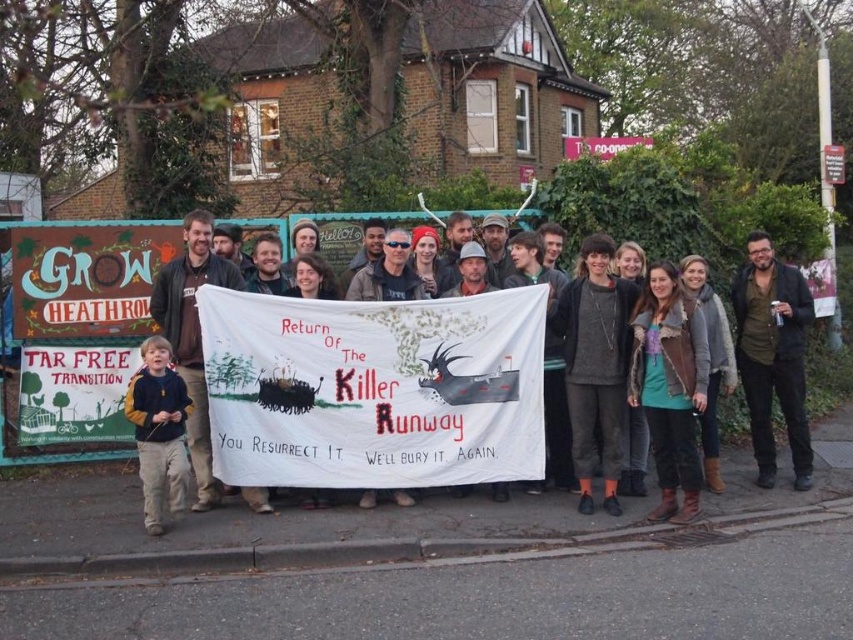
Question: Which object appears farthest from the camera in this image?

Choices:
 (A) black leather jacket at right
 (B) wooden signboard at left
 (C) brown suede boots at lower center
 (D) velvet yellow sweater at lower left

Answer: (B)

Question: Among these points, which one is farthest from the camera?

Choices:
 (A) (21, 413)
 (B) (173, 412)
 (C) (808, 312)
 (D) (210, 500)

Answer: (A)

Question: Where is dark gray sweater at center located in relation to brown suede boots at lower center in the image?

Choices:
 (A) above
 (B) below

Answer: (A)

Question: Which point appears closest to the camera in this image?

Choices:
 (A) (199, 248)
 (B) (323, 474)
 (C) (802, 321)
 (D) (102, 438)

Answer: (B)

Question: Is wooden signboard at left positioned behind brown suede boots at lower center?

Choices:
 (A) yes
 (B) no

Answer: (A)

Question: Is dark brown leather jacket at center further to the viewer compared to dark blue shirt at left?

Choices:
 (A) no
 (B) yes

Answer: (B)